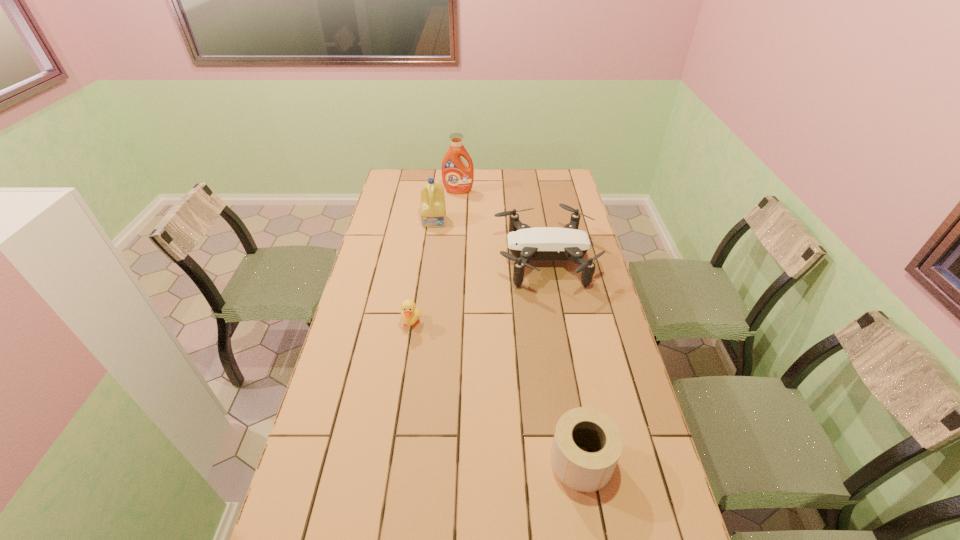
Where is `the farther detergent`? This screenshot has width=960, height=540. the farther detergent is located at coordinates (457, 177).

In order to click on the tallest object in this screenshot , I will do `click(457, 177)`.

This screenshot has width=960, height=540. In order to click on the nearer detergent in this screenshot , I will do `click(433, 210)`.

Image resolution: width=960 pixels, height=540 pixels. Find the location of `the fourth nearest object`. the fourth nearest object is located at coordinates (433, 210).

You are a GUI agent. You are given a task and a screenshot of the screen. Output one action in this format:
    pyautogui.click(x=<x>, y=<y>)
    Task: Click on the drone
    
    Given the screenshot: What is the action you would take?
    pyautogui.click(x=526, y=244)

Locate an element on the screen. The width and height of the screenshot is (960, 540). toilet tissue is located at coordinates (582, 471).

This screenshot has width=960, height=540. I want to click on the fourth farthest object, so click(410, 313).

At what (x,y) coordinates should I click in order to perform the action: click on vacant space positioned on the front-facing side of the tallest object. Please return your answer as a coordinate pair (x, y). Looking at the image, I should click on (455, 237).

Where is `free region located 0.320m on the label of the second tallest object`? The image size is (960, 540). free region located 0.320m on the label of the second tallest object is located at coordinates (427, 278).

Locate an element on the screen. The height and width of the screenshot is (540, 960). blank space located 0.310m on the camera side of the third nearest object is located at coordinates (417, 260).